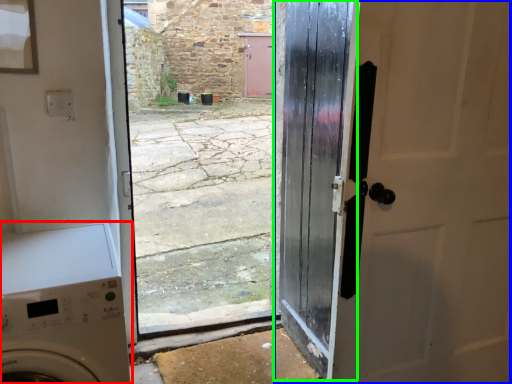
Question: Which object is positioned farthest from washing machine (highlighted by a red box)? Select from door (highlighted by a blue box) and door (highlighted by a green box).

Choices:
 (A) door
 (B) door

Answer: (A)